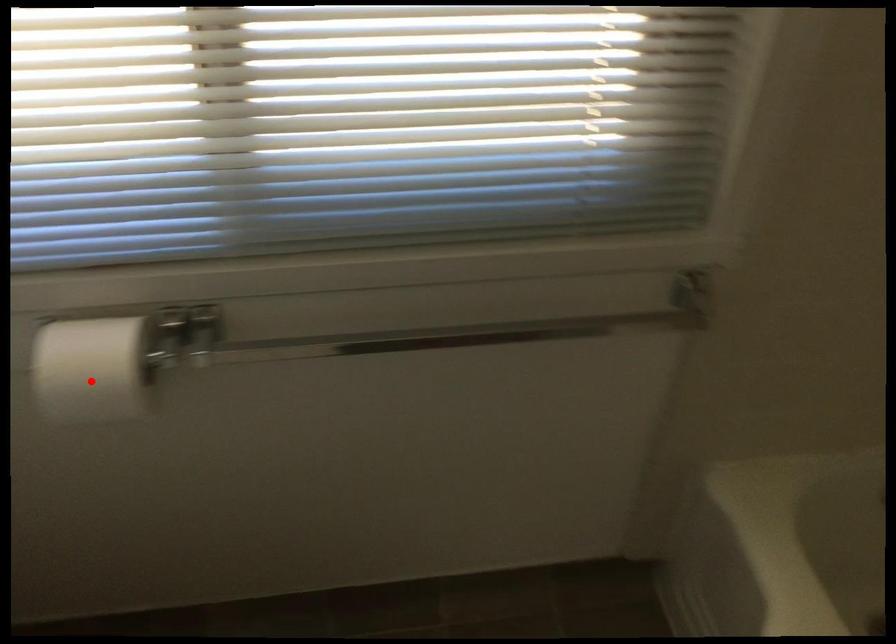
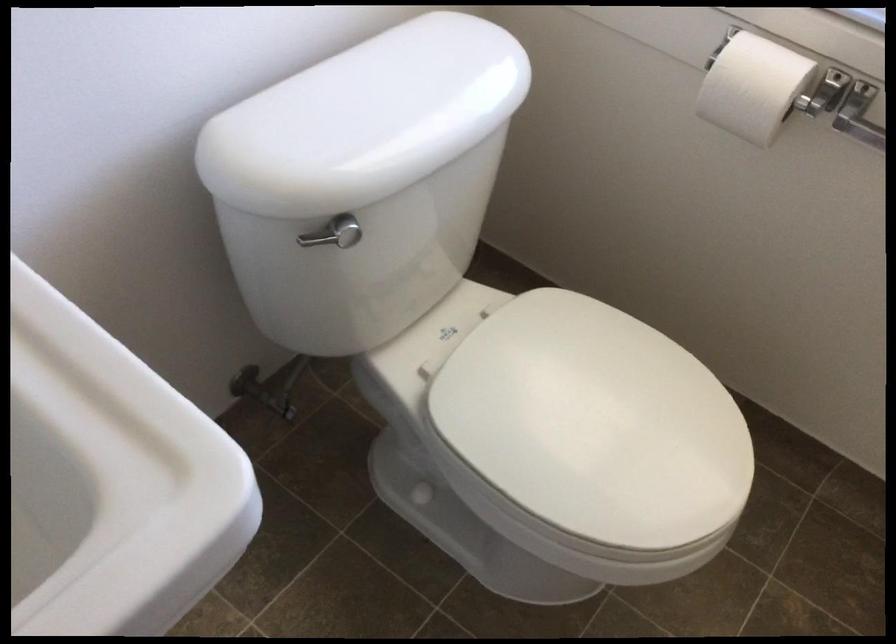
Question: I am providing you with two images of the same scene from different viewpoints. In image1, a red point is highlighted. Considering the same 3D point in image2, which of the following is correct?

Choices:
 (A) It is closer
 (B) It is farther

Answer: (B)